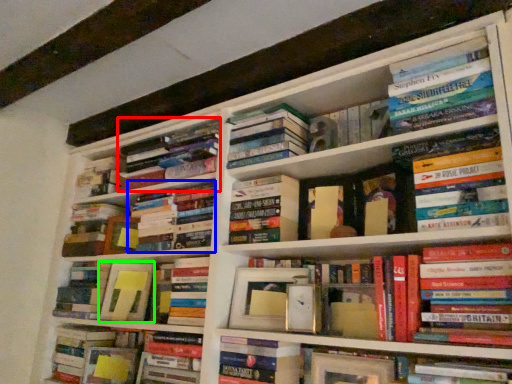
Question: Which object is the closest to the book (highlighted by a red box)? Choose among these: book (highlighted by a blue box) or paperback book (highlighted by a green box).

Choices:
 (A) book
 (B) paperback book

Answer: (A)